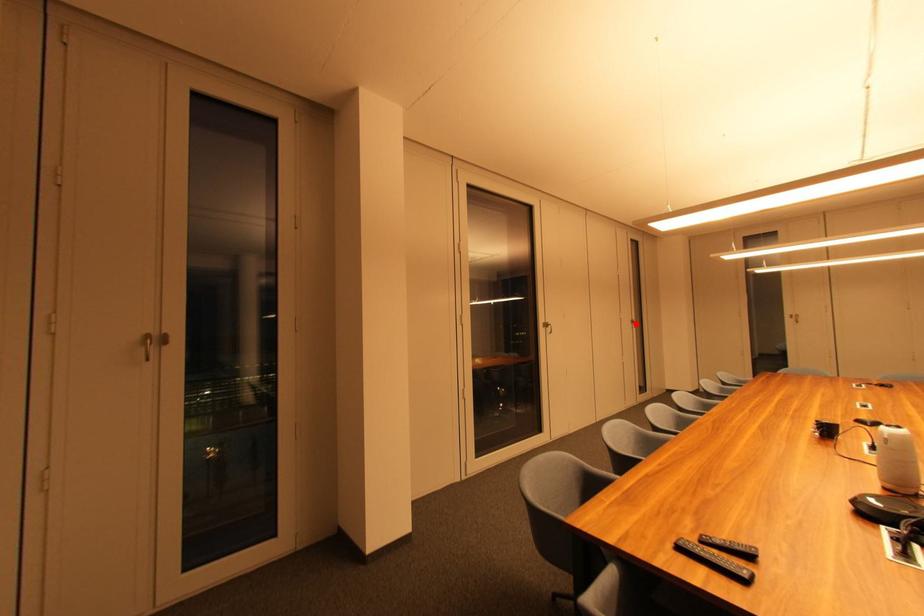
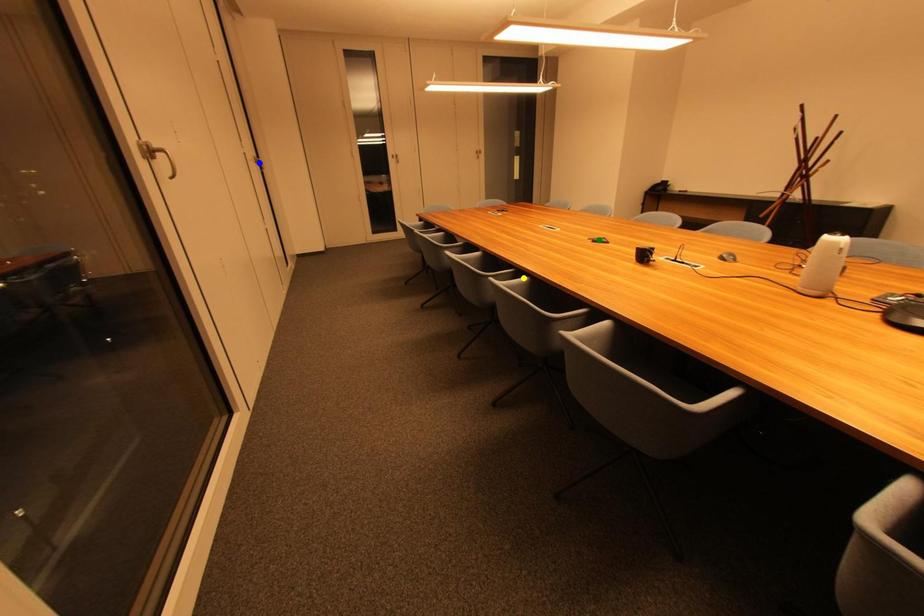
Question: I am providing you with two images of the same scene from different viewpoints. A red point is marked on the first image. You are given multiple points on the second image. Which mark in image 2 goes with the point in image 1?

Choices:
 (A) yellow point
 (B) green point
 (C) blue point

Answer: (C)